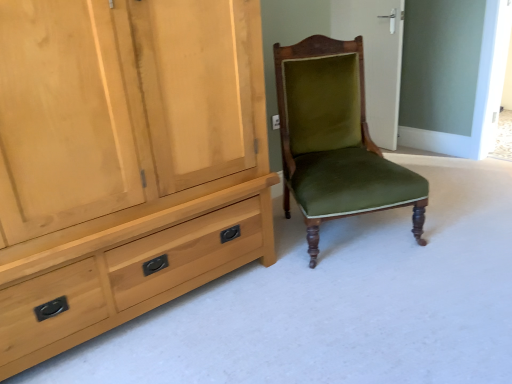
The height and width of the screenshot is (384, 512). Find the location of `vacant location below velvet green chair at center (from a real-world perspective)`. vacant location below velvet green chair at center (from a real-world perspective) is located at coordinates (353, 234).